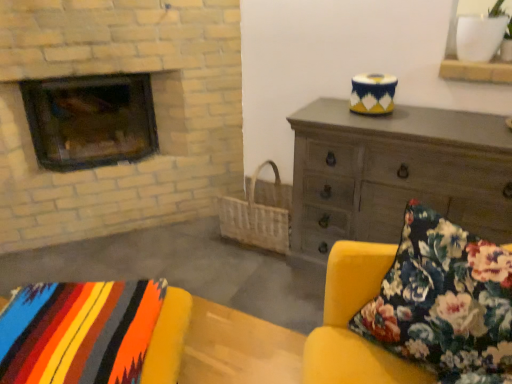
Question: Would you say dark brown wood burning stove at left contains dark gray wooden chest of drawers at upper right?

Choices:
 (A) no
 (B) yes

Answer: (A)

Question: Is dark brown wood burning stove at left shorter than dark gray wooden chest of drawers at upper right?

Choices:
 (A) yes
 (B) no

Answer: (A)

Question: Is dark brown wood burning stove at left far away from dark gray wooden chest of drawers at upper right?

Choices:
 (A) no
 (B) yes

Answer: (B)

Question: Could you tell me if dark brown wood burning stove at left is turned towards dark gray wooden chest of drawers at upper right?

Choices:
 (A) no
 (B) yes

Answer: (A)

Question: Can you confirm if dark brown wood burning stove at left is smaller than dark gray wooden chest of drawers at upper right?

Choices:
 (A) no
 (B) yes

Answer: (B)

Question: From a real-world perspective, is dark brown wood burning stove at left positioned over dark gray wooden chest of drawers at upper right based on gravity?

Choices:
 (A) no
 (B) yes

Answer: (B)

Question: Is floral fabric cushion at lower right located outside dark gray wooden chest of drawers at upper right?

Choices:
 (A) no
 (B) yes

Answer: (B)

Question: Is floral fabric cushion at lower right further to camera compared to dark gray wooden chest of drawers at upper right?

Choices:
 (A) no
 (B) yes

Answer: (A)

Question: From the image's perspective, is floral fabric cushion at lower right on dark gray wooden chest of drawers at upper right?

Choices:
 (A) no
 (B) yes

Answer: (A)

Question: Does floral fabric cushion at lower right have a smaller size compared to dark gray wooden chest of drawers at upper right?

Choices:
 (A) no
 (B) yes

Answer: (B)

Question: From a real-world perspective, is floral fabric cushion at lower right located higher than dark gray wooden chest of drawers at upper right?

Choices:
 (A) yes
 (B) no

Answer: (A)

Question: From the image's perspective, does floral fabric cushion at lower right appear lower than dark gray wooden chest of drawers at upper right?

Choices:
 (A) yes
 (B) no

Answer: (A)

Question: Is floral fabric cushion at lower right placed right next to multicolored woven blanket at lower left?

Choices:
 (A) yes
 (B) no

Answer: (B)